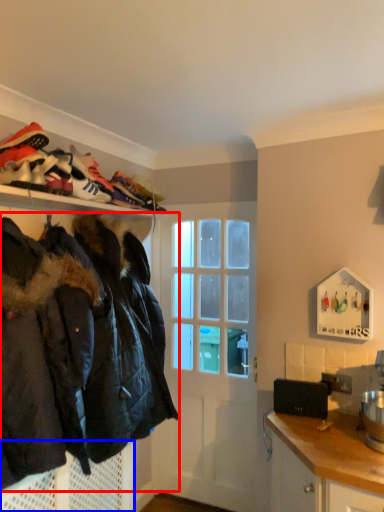
Question: Which point is closer to the camera, jacket (highlighted by a red box) or cabinetry (highlighted by a blue box)?

Choices:
 (A) jacket
 (B) cabinetry

Answer: (A)